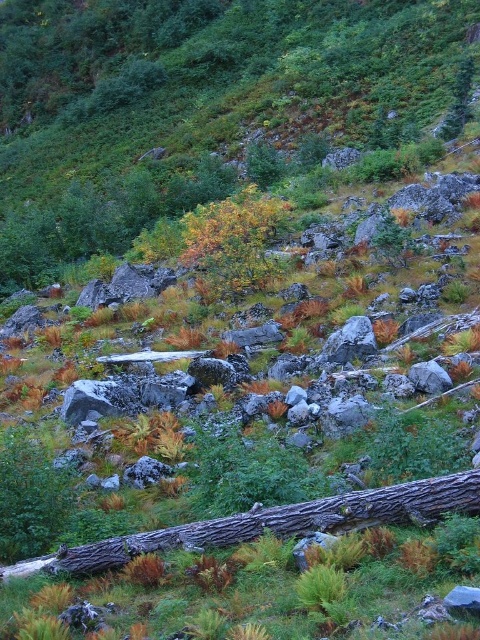
You are a hiker who wants to cross the rough bark log at center. The log is 1.5 meters wide. If your backpack is 1.6 meters wide, can you safely walk across the log with your backpack on?

The rough bark log at center is 12.23 meters away from the camera, but the width of the log is 1.5 meters. Since your backpack is 1.6 meters wide, it is wider than the log. Therefore, you cannot safely walk across the log with your backpack on.